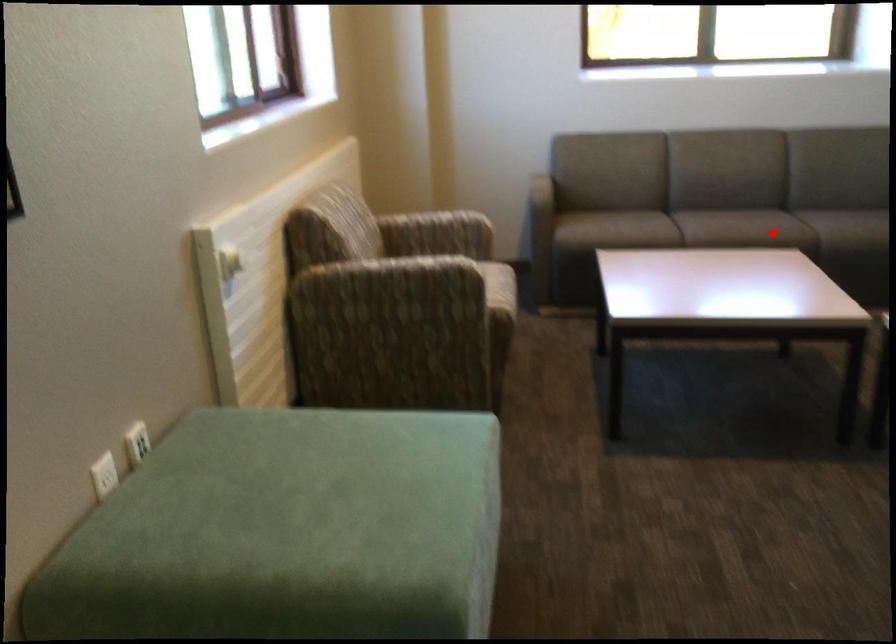
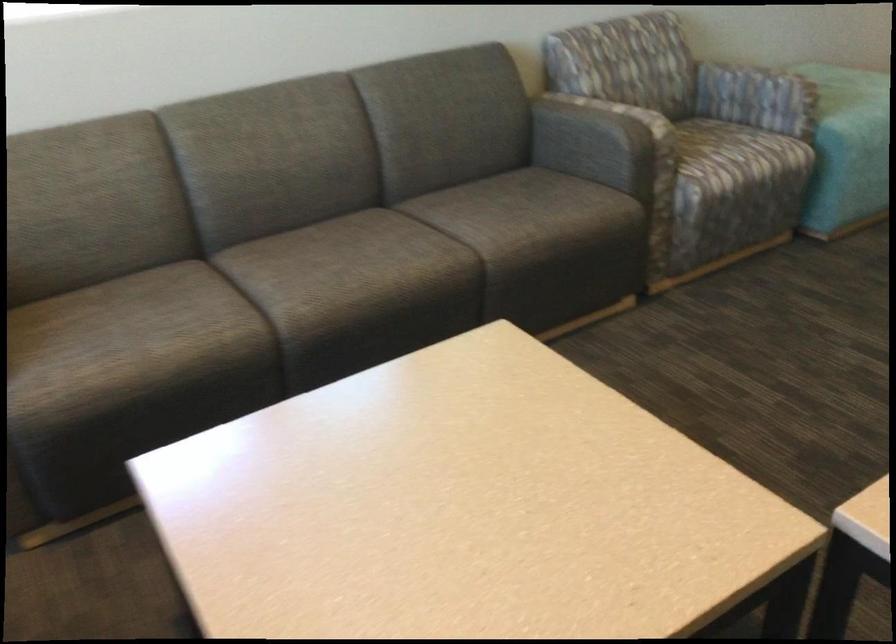
Question: I am providing you with two images of the same scene from different viewpoints. A red point is shown in image1. For the corresponding object point in image2, is it positioned nearer or farther from the camera?

Choices:
 (A) Nearer
 (B) Farther

Answer: (A)